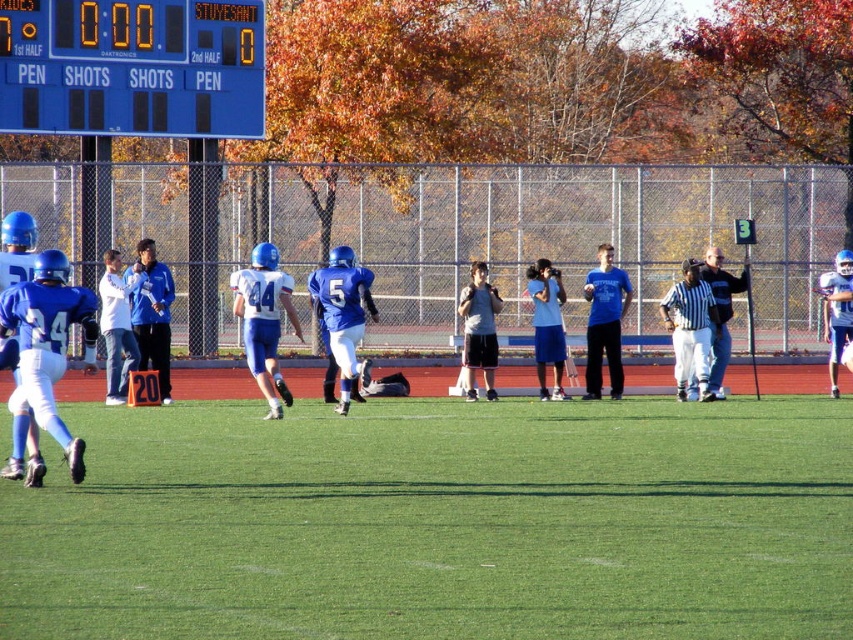
Question: Does green grass at center have a greater width compared to blue plastic scoreboard at upper left?

Choices:
 (A) yes
 (B) no

Answer: (A)

Question: Which of the following is the farthest from the observer?

Choices:
 (A) green grass at center
 (B) blue plastic scoreboard at upper left

Answer: (B)

Question: Which of the following is the farthest from the observer?

Choices:
 (A) (128, 54)
 (B) (442, 461)

Answer: (A)

Question: Among these points, which one is nearest to the camera?

Choices:
 (A) (346, 552)
 (B) (224, 3)

Answer: (A)

Question: Is green grass at center thinner than blue plastic scoreboard at upper left?

Choices:
 (A) yes
 (B) no

Answer: (B)

Question: Does green grass at center have a smaller size compared to blue plastic scoreboard at upper left?

Choices:
 (A) yes
 (B) no

Answer: (B)